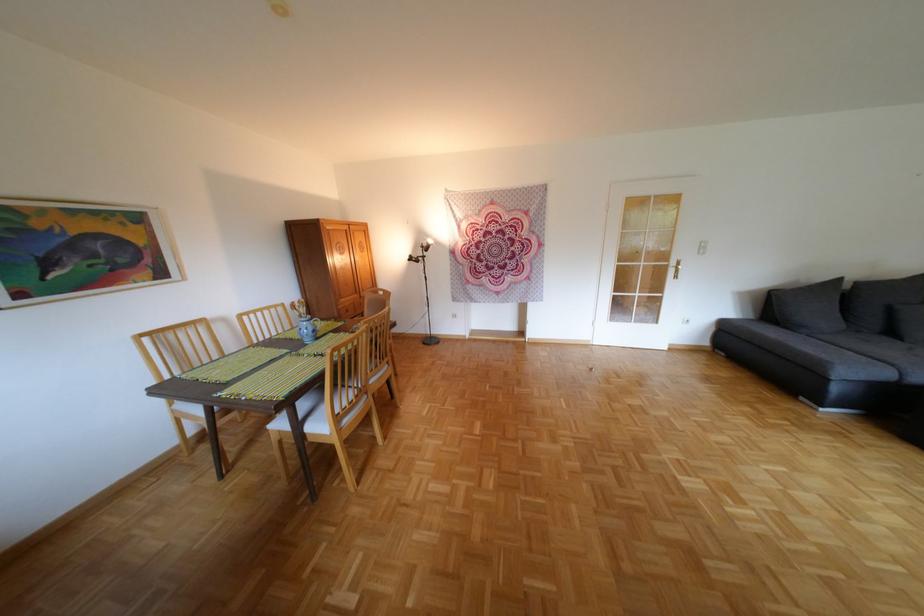
Find where to pull the shiny cabinet handle. Please return your answer as a coordinate pair (x, y).

(361, 273)